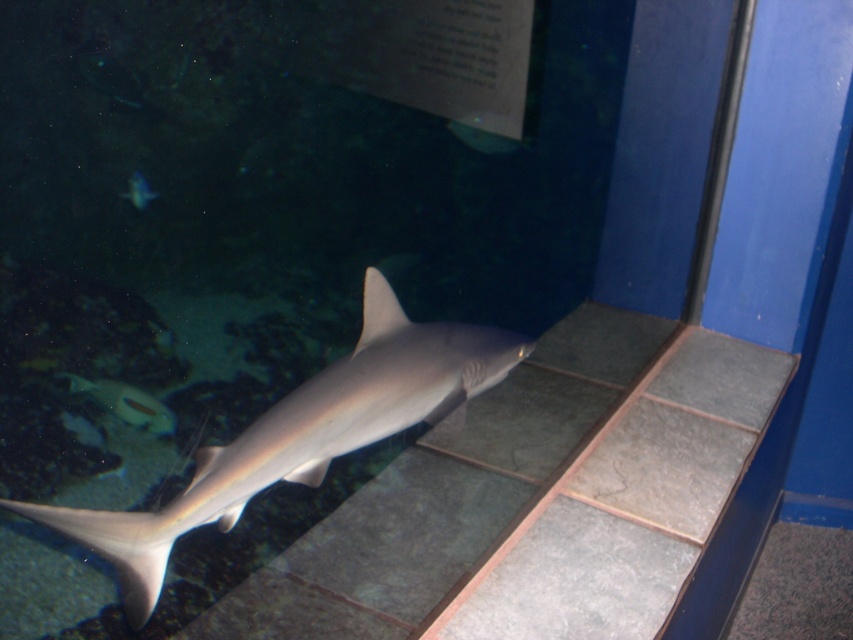
Question: Which point is closer to the camera taking this photo?

Choices:
 (A) (379, 317)
 (B) (335, 444)
 (C) (119, 403)

Answer: (B)

Question: Estimate the real-world distances between objects in this image. Which object is farther from the gray matte fin at center?

Choices:
 (A) shiny silver fish at lower left
 (B) smooth gray shark at center
 (C) translucent blue fish at upper left

Answer: (C)

Question: Can you confirm if smooth gray shark at center is smaller than translucent blue fish at upper left?

Choices:
 (A) no
 (B) yes

Answer: (A)

Question: Which point appears closest to the camera in this image?

Choices:
 (A) coord(376,308)
 (B) coord(131,404)

Answer: (A)

Question: Can you confirm if smooth gray shark at center is positioned above translucent blue fish at upper left?

Choices:
 (A) no
 (B) yes

Answer: (A)

Question: Is smooth gray shark at center bigger than translucent blue fish at upper left?

Choices:
 (A) no
 (B) yes

Answer: (B)